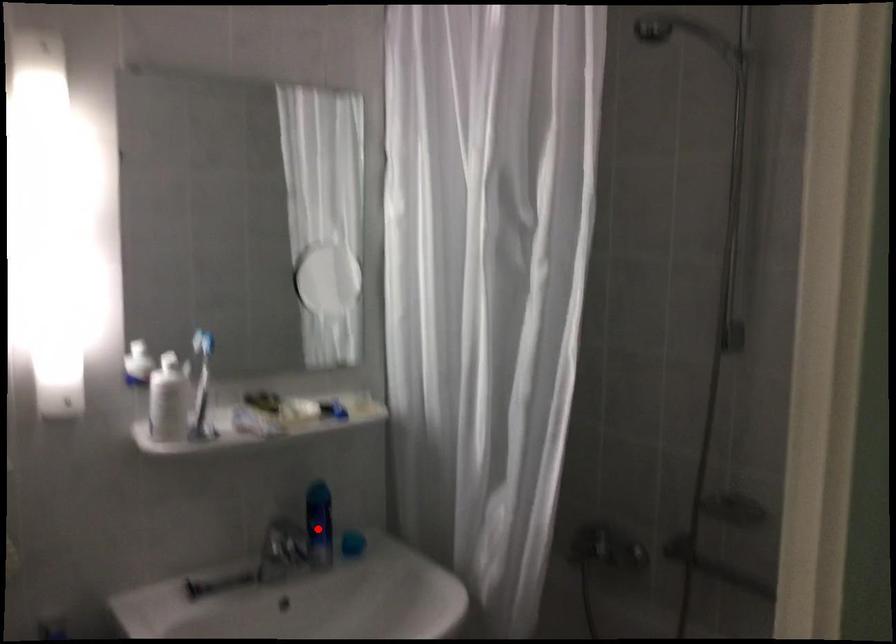
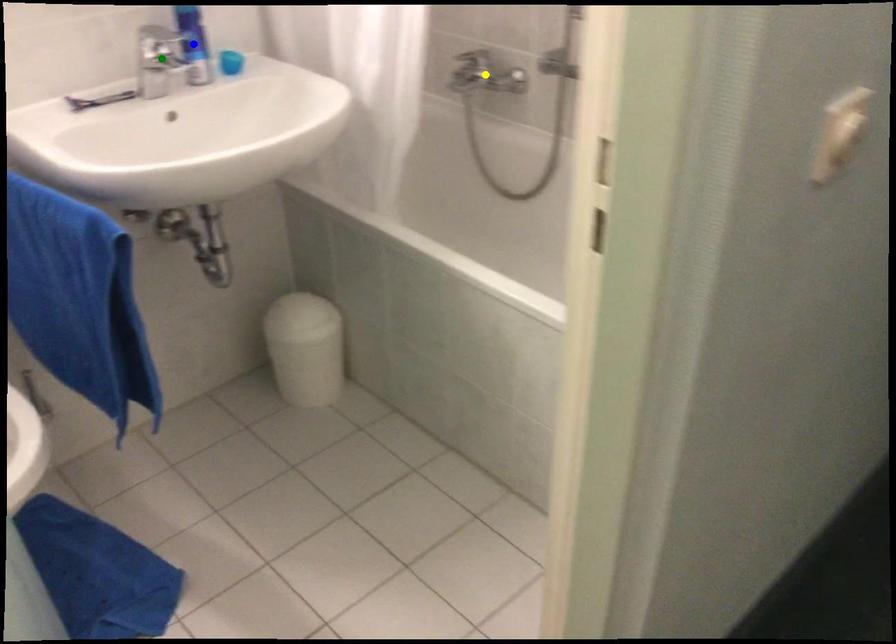
Question: I am providing you with two images of the same scene from different viewpoints. A red point is marked on the first image. You are given multiple points on the second image. Can you choose the point in image 2 that corresponds to the point in image 1?

Choices:
 (A) yellow point
 (B) green point
 (C) blue point

Answer: (C)